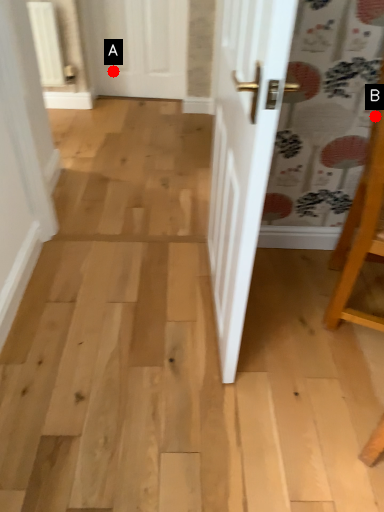
Question: Two points are circled on the image, labeled by A and B beside each circle. Among these points, which one is farthest from the camera?

Choices:
 (A) A is further
 (B) B is further

Answer: (A)